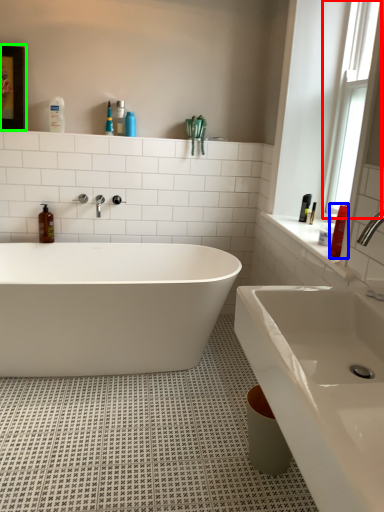
Question: Based on their relative distances, which object is farther from window (highlighted by a red box)? Choose from toiletry (highlighted by a blue box) and medicine cabinet (highlighted by a green box).

Choices:
 (A) toiletry
 (B) medicine cabinet

Answer: (B)